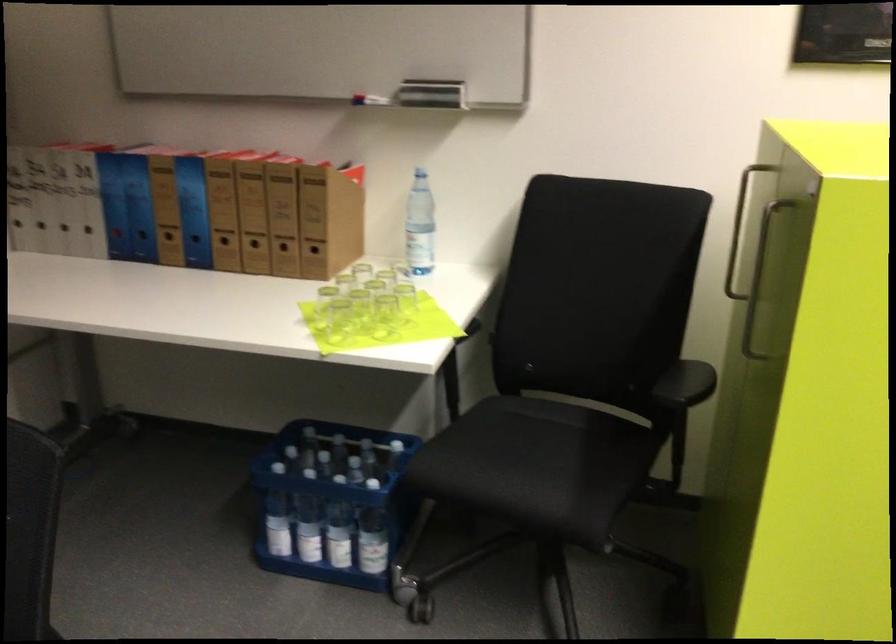
Find where to sit the chair sitting surface. Please return your answer as a coordinate pair (x, y).

(552, 462)